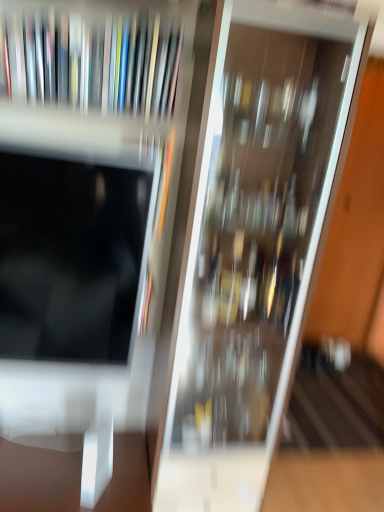
Where is `matte plastic books at upper left`? Image resolution: width=384 pixels, height=512 pixels. matte plastic books at upper left is located at coordinates (90, 60).

What is the approximate height of matte plastic books at upper left?

9.62 inches.

The height and width of the screenshot is (512, 384). Describe the element at coordinates (90, 60) in the screenshot. I see `matte plastic books at upper left` at that location.

Identify the location of matte plastic books at upper left. This screenshot has height=512, width=384. (90, 60).